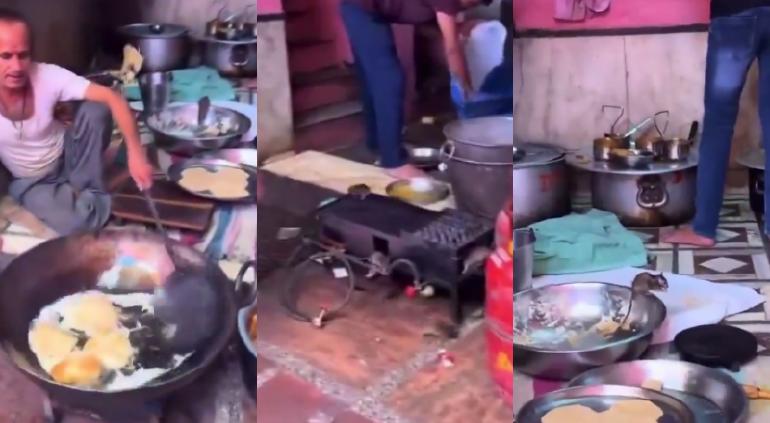
At what (x,y) coordinates should I click in order to perform the action: click on cord. Please return your answer as a coordinate pair (x, y). Looking at the image, I should click on (317, 316).